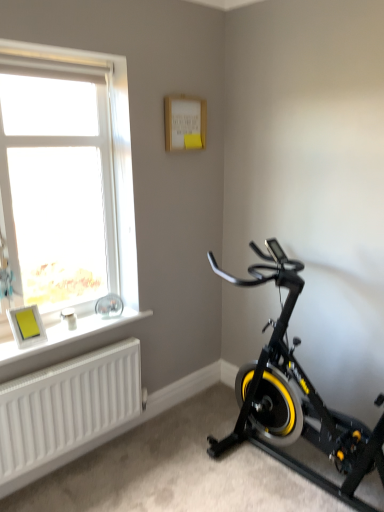
Question: Is white plastic window at upper left taller than matte yellow picture frame at lower left?

Choices:
 (A) yes
 (B) no

Answer: (A)

Question: From the image's perspective, is white plastic window at upper left on matte yellow picture frame at lower left?

Choices:
 (A) yes
 (B) no

Answer: (A)

Question: Is white plastic window at upper left shorter than matte yellow picture frame at lower left?

Choices:
 (A) yes
 (B) no

Answer: (B)

Question: Is white plastic window at upper left positioned behind matte yellow picture frame at lower left?

Choices:
 (A) yes
 (B) no

Answer: (B)

Question: Is matte yellow picture frame at lower left located within white plastic window at upper left?

Choices:
 (A) yes
 (B) no

Answer: (B)

Question: Which is correct: white plastic window at upper left is inside black matte stationary bicycle at lower right, or outside of it?

Choices:
 (A) inside
 (B) outside

Answer: (B)

Question: Does point (11, 123) appear closer or farther from the camera than point (276, 252)?

Choices:
 (A) farther
 (B) closer

Answer: (B)

Question: Considering the positions of white plastic window at upper left and black matte stationary bicycle at lower right in the image, is white plastic window at upper left wider or thinner than black matte stationary bicycle at lower right?

Choices:
 (A) thin
 (B) wide

Answer: (A)

Question: Considering their positions, is white plastic window at upper left located in front of or behind black matte stationary bicycle at lower right?

Choices:
 (A) front
 (B) behind

Answer: (B)

Question: Is point (3, 357) positioned closer to the camera than point (33, 332)?

Choices:
 (A) farther
 (B) closer

Answer: (B)

Question: Is white matte window sill at lower left inside the boundaries of matte yellow picture frame at lower left, or outside?

Choices:
 (A) outside
 (B) inside

Answer: (A)

Question: Relative to matte yellow picture frame at lower left, is white matte window sill at lower left in front or behind?

Choices:
 (A) behind
 (B) front

Answer: (B)

Question: From the image's perspective, is white matte window sill at lower left above or below matte yellow picture frame at lower left?

Choices:
 (A) below
 (B) above

Answer: (A)

Question: Would you say matte yellow picture frame at lower left is inside or outside black matte stationary bicycle at lower right?

Choices:
 (A) outside
 (B) inside

Answer: (A)

Question: From a real-world perspective, relative to black matte stationary bicycle at lower right, is matte yellow picture frame at lower left vertically above or below?

Choices:
 (A) below
 (B) above

Answer: (B)